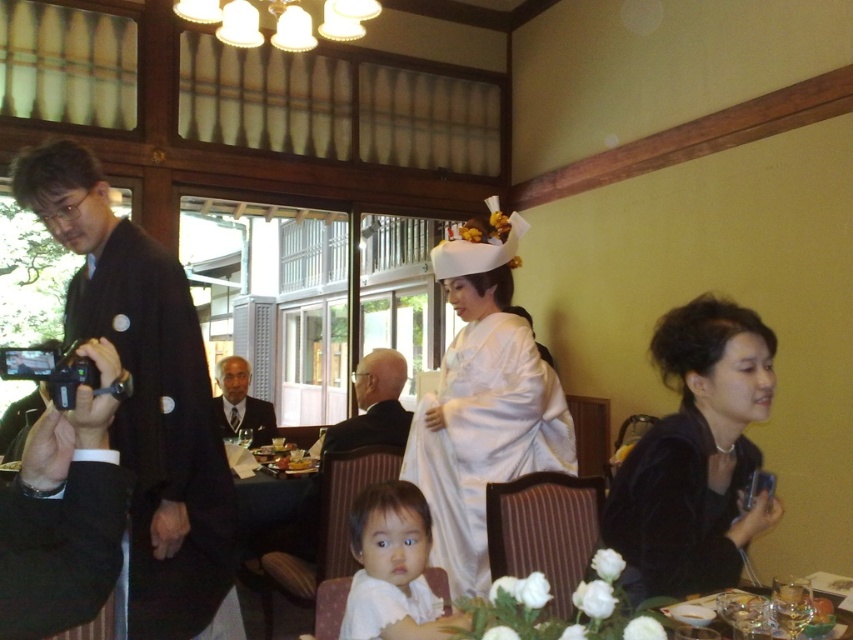
Question: Can you confirm if black kimono at left is positioned above white silk robe at lower center?

Choices:
 (A) yes
 (B) no

Answer: (A)

Question: Which of the following is the closest to the observer?

Choices:
 (A) (175, 481)
 (B) (228, 378)
 (C) (392, 397)

Answer: (A)

Question: Can you confirm if black kimono at left is positioned below black velvet dress at lower right?

Choices:
 (A) yes
 (B) no

Answer: (B)

Question: Which point appears closest to the camera in this image?

Choices:
 (A) (206, 589)
 (B) (474, 316)
 (C) (625, 584)
 (D) (248, 419)

Answer: (C)

Question: Can you confirm if white silk kimono at center is bigger than dark brown suit at center?

Choices:
 (A) yes
 (B) no

Answer: (A)

Question: Which of the following is the farthest from the observer?

Choices:
 (A) white silk kimono at center
 (B) black kimono at left
 (C) dark suit at center
 (D) dark brown suit at center

Answer: (C)